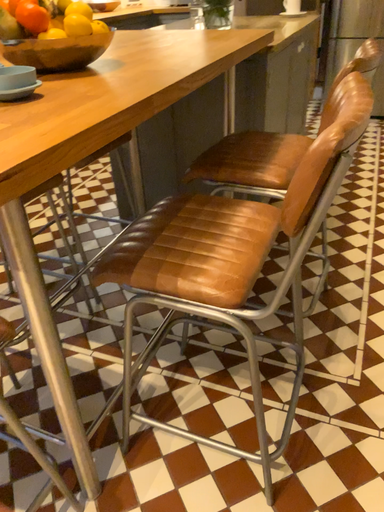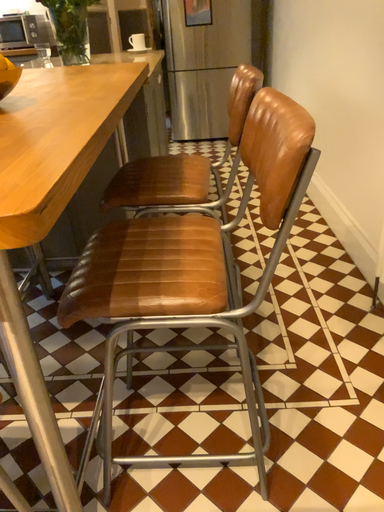
Question: How did the camera likely rotate when shooting the video?

Choices:
 (A) rotated upward
 (B) rotated downward

Answer: (A)